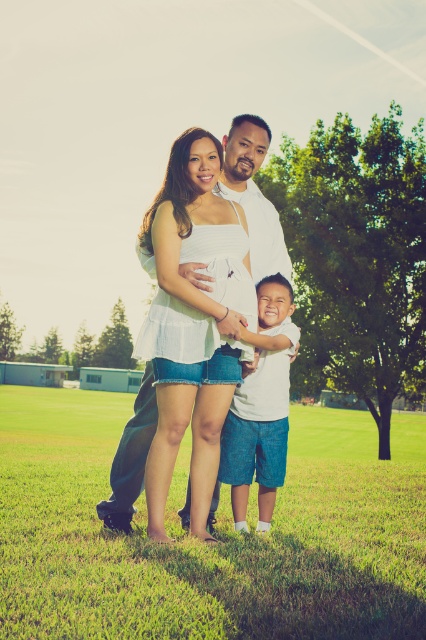
You are standing in the middle of the grassy field in the image. If you look down, what do you see at the coordinates point [218,529]?

At the coordinates point [218,529], you would see green grass at lower center.

In the scene shown: You are standing at point (143, 528) and want to take a photo of the family. The camera you are using has a focal length of 50mm and a sensor size of 24mm x 36mm. What is the minimum distance you need to move closer to ensure the entire family fits within the camera frame?

The minimum distance required to ensure the entire family fits within the camera frame is 5.10 meters, as the point (143, 528) is already positioned 5.10 meters away from the camera, which is the optimal distance for capturing the family within the frame dimensions based on the given focal length and sensor size.

You are a photographer trying to capture a family portrait. You notice the white matte dress at center and the white cotton shirt at center. Which clothing item should you focus on first if you want to ensure the tallest item is in sharp focus?

The white matte dress at center is much taller than the white cotton shirt at center, so you should focus on the white matte dress at center first to ensure it is in sharp focus.